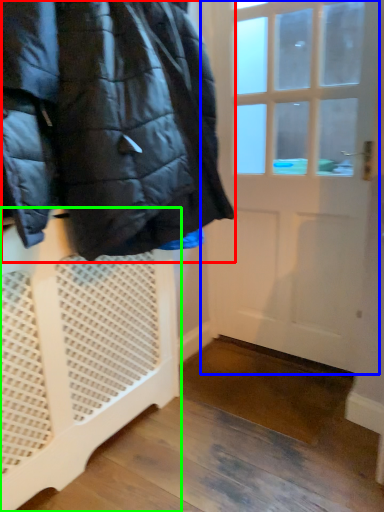
Question: Considering the real-world distances, which object is farthest from jacket (highlighted by a red box)? door (highlighted by a blue box) or furniture (highlighted by a green box)?

Choices:
 (A) door
 (B) furniture

Answer: (A)